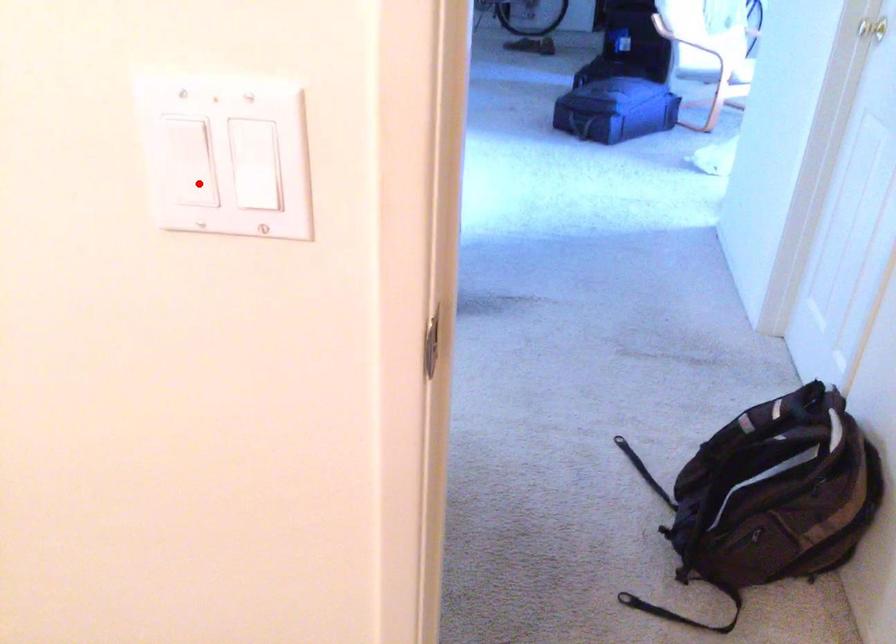
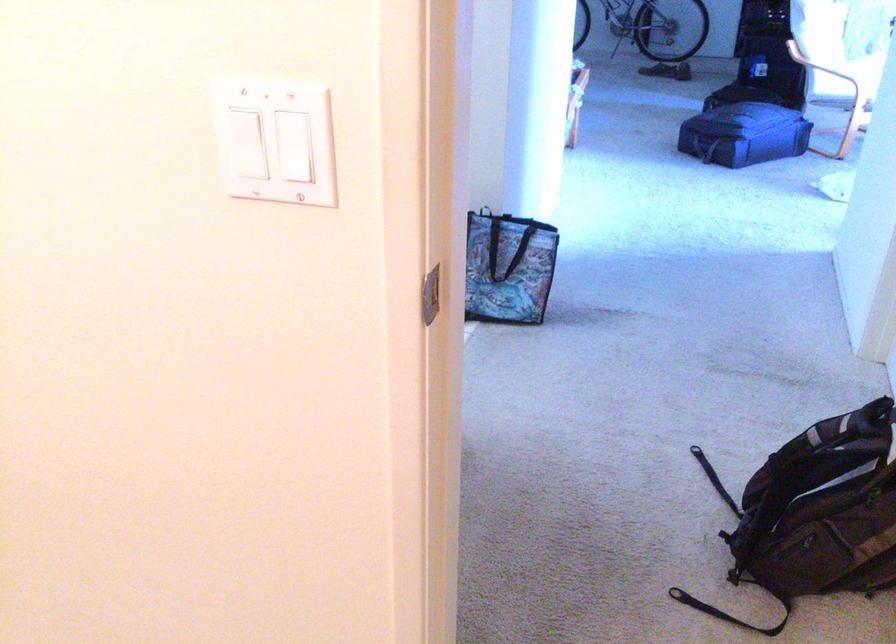
Question: I am providing you with two images of the same scene from different viewpoints. Given a red point in image1, look at the same physical point in image2. Is it:

Choices:
 (A) Closer to the viewpoint
 (B) Farther from the viewpoint

Answer: (B)